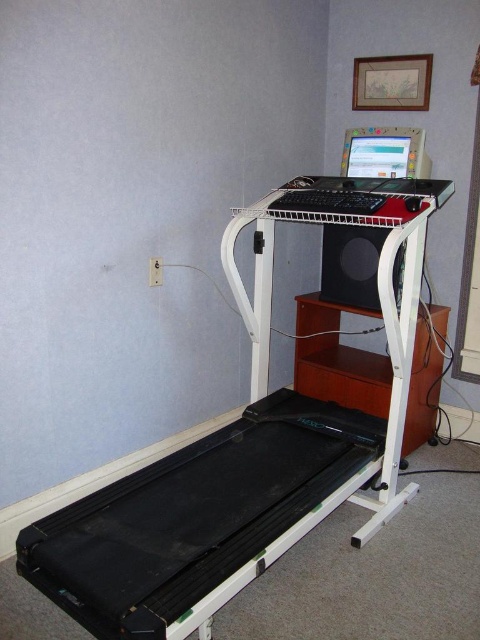
Based on the photo, you are organizing a home office and want to place both the black rubber treadmill at lower left and the black matte speaker at center on a shelf. Which object should be placed first to ensure they both fit?

The black rubber treadmill at lower left is wider than the black matte speaker at center. Therefore, place the black rubber treadmill at lower left first to accommodate its larger width, ensuring both items fit on the shelf.

You are setting up a home office and need to place a new monitor between the white plastic computer desk at center and the black matte speaker at center. Based on their current positions, which object should the monitor be placed closer to?

The white plastic computer desk at center is to the left of the black matte speaker at center, so the monitor should be placed closer to the white plastic computer desk at center to maintain symmetry or alignment with the existing setup.

You are setting up a new lamp in the room. You want to place it on the highest available surface. Which object should you choose between the black rubber treadmill at lower left and the black matte speaker at center?

The black rubber treadmill at lower left is much taller than the black matte speaker at center, so you should place the lamp on the black rubber treadmill at lower left.